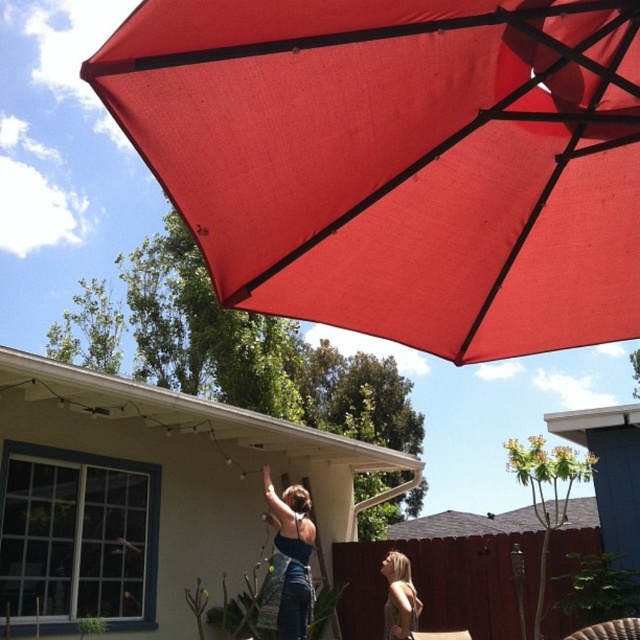
You are a photographer planning to take a portrait of the two people in the scene. Since you want to focus on their clothing and hair, you need to know which of the two has a wider feature between the matte blue dress at center and the golden brown hair at lower right. Which one should you focus on?

The matte blue dress at center has a greater width than the golden brown hair at lower right, so you should focus on the matte blue dress at center for its wider feature.

You are standing in the backyard and want to place a new bird feeder. You have two points marked as potential locations for the feeder. The first point is at coordinates point (410,248) and the second is at point (282,593). Which point is closer to you?

Point (410,248) is closer to the viewer than point (282,593).

You are standing at point [346,45] and want to take a photo of the scene. The camera you have can only focus on objects within 1.5 meters. Will the camera be able to focus on the scene?

The distance between point [346,45] and the camera is 1.75 meters, which is beyond the camera focus range of 1.5 meters. Therefore, the camera cannot focus on the scene from that point.